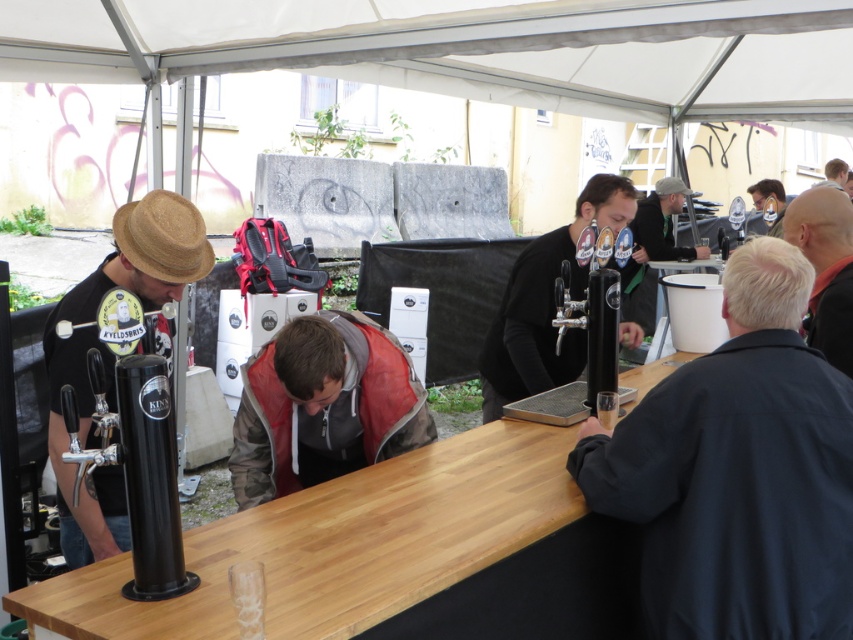
Based on the photo, between white fabric canopy at upper center and matte black jacket at center, which one is positioned lower?

matte black jacket at center is below.

The height and width of the screenshot is (640, 853). What do you see at coordinates (473, 49) in the screenshot?
I see `white fabric canopy at upper center` at bounding box center [473, 49].

Does point (814, 65) come behind point (637, 240)?

No, (814, 65) is in front of (637, 240).

The height and width of the screenshot is (640, 853). I want to click on white fabric canopy at upper center, so click(473, 49).

Is dark blue jacket at right smaller than matte black hat at left?

Correct, dark blue jacket at right occupies less space than matte black hat at left.

Does dark blue jacket at right have a greater height compared to matte black hat at left?

No.

The height and width of the screenshot is (640, 853). Describe the element at coordinates (738, 472) in the screenshot. I see `dark blue jacket at right` at that location.

Identify the location of dark blue jacket at right. (738, 472).

Is matte black beer tap at center shorter than bald head at upper right?

No, matte black beer tap at center is not shorter than bald head at upper right.

Is matte black beer tap at center to the left of bald head at upper right from the viewer's perspective?

Yes, matte black beer tap at center is to the left of bald head at upper right.

Locate an element on the screen. This screenshot has width=853, height=640. matte black beer tap at center is located at coordinates (546, 304).

You are a GUI agent. You are given a task and a screenshot of the screen. Output one action in this format:
    pyautogui.click(x=<x>, y=<y>)
    Task: Click on the matte black beer tap at center
    This screenshot has height=640, width=853.
    Given the screenshot: What is the action you would take?
    pyautogui.click(x=546, y=304)